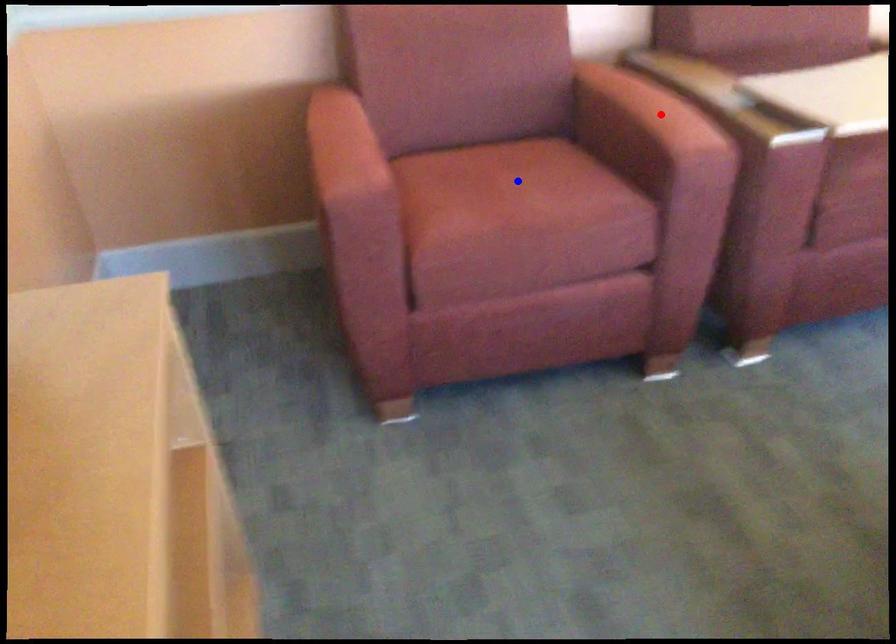
Question: In the image, two points are highlighted. Which point is nearer to the camera? Reply with the corresponding letter.

Choices:
 (A) blue point
 (B) red point

Answer: (B)